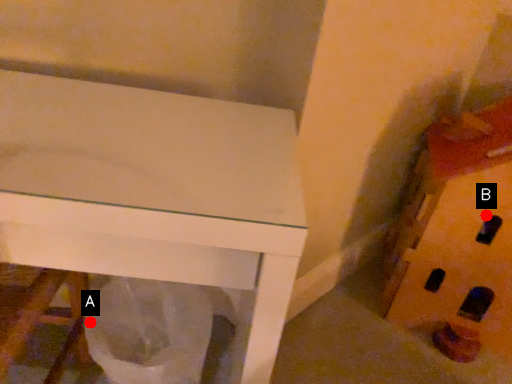
Question: Two points are circled on the image, labeled by A and B beside each circle. Which point is farther from the camera taking this photo?

Choices:
 (A) A is further
 (B) B is further

Answer: (B)